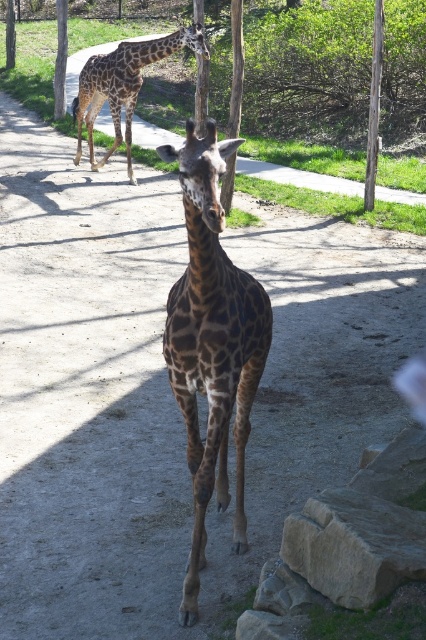
Question: Which of the following is the farthest from the observer?

Choices:
 (A) (115, 115)
 (B) (206, 240)

Answer: (A)

Question: Is spotted fur giraffe at center above brown spotted giraffe at upper left?

Choices:
 (A) yes
 (B) no

Answer: (B)

Question: Which point is closer to the camera?

Choices:
 (A) (129, 163)
 (B) (192, 320)

Answer: (B)

Question: In this image, where is spotted fur giraffe at center located relative to brown spotted giraffe at upper left?

Choices:
 (A) right
 (B) left

Answer: (A)

Question: Can you confirm if spotted fur giraffe at center is positioned above brown spotted giraffe at upper left?

Choices:
 (A) no
 (B) yes

Answer: (A)